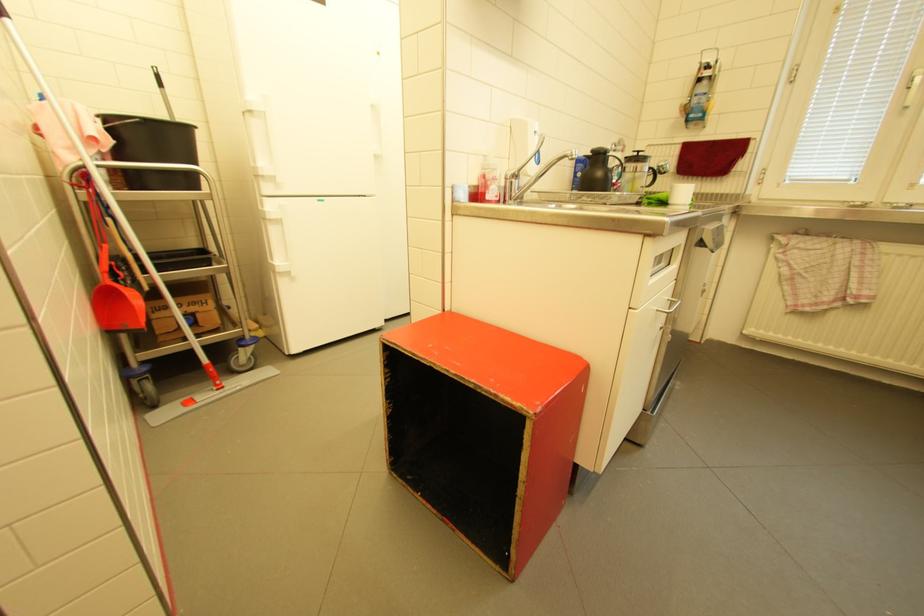
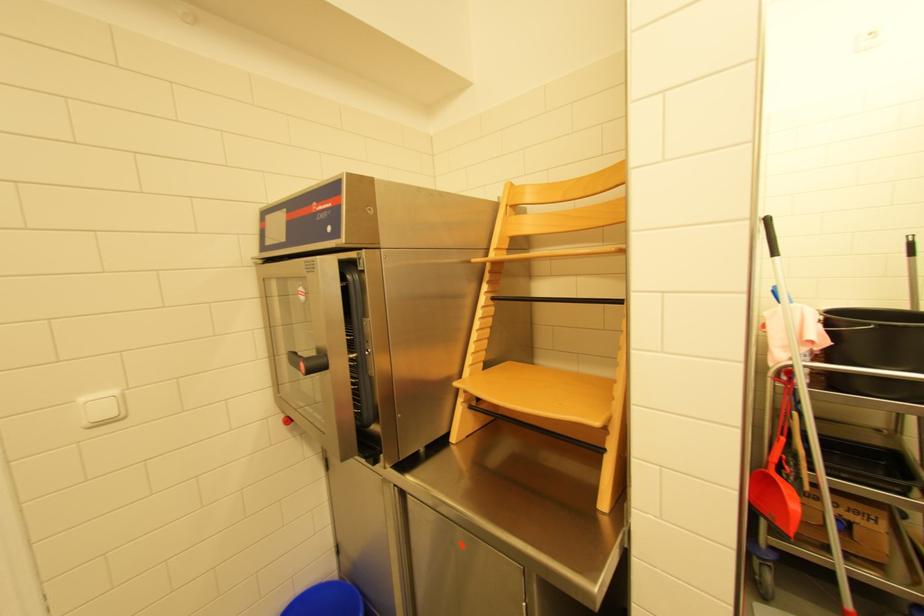
Question: The camera is either moving clockwise (left) or counter-clockwise (right) around the object. The first image is from the beginning of the video and the second image is from the end. Is the camera moving left or right when shooting the video?

Choices:
 (A) Left
 (B) Right

Answer: (B)